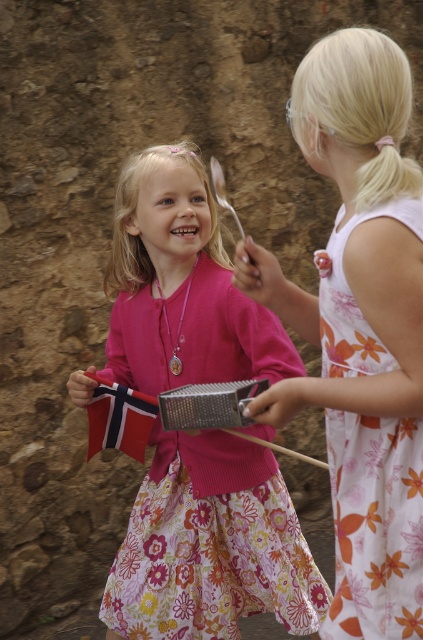
Which of these two, pink matte sweater at center or floral dress at center, stands shorter?

Standing shorter between the two is floral dress at center.

Which is more to the left, pink matte sweater at center or floral dress at center?

From the viewer's perspective, pink matte sweater at center appears more on the left side.

Measure the distance between point (x=244, y=374) and camera.

They are 8.88 feet apart.

The width and height of the screenshot is (423, 640). Find the location of `pink matte sweater at center`. pink matte sweater at center is located at coordinates (211, 545).

Who is taller, floral dress at center or floral cotton dress at right?

floral dress at center is taller.

Measure the distance between point (379, 403) and camera.

Point (379, 403) and camera are 1.79 meters apart.

The image size is (423, 640). Find the location of `floral dress at center`. floral dress at center is located at coordinates click(359, 326).

Describe the element at coordinates (211, 545) in the screenshot. This screenshot has height=640, width=423. I see `pink matte sweater at center` at that location.

The height and width of the screenshot is (640, 423). I want to click on pink matte sweater at center, so click(211, 545).